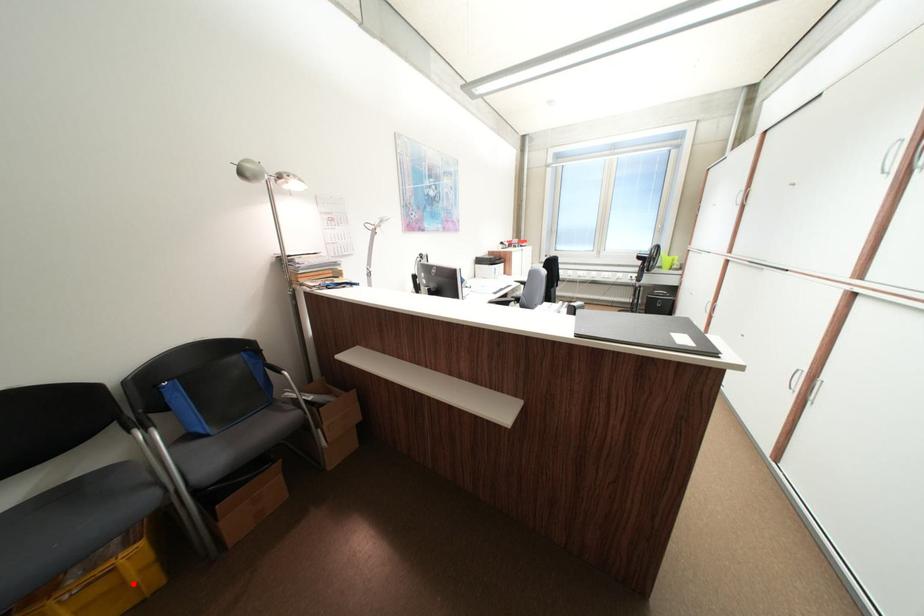
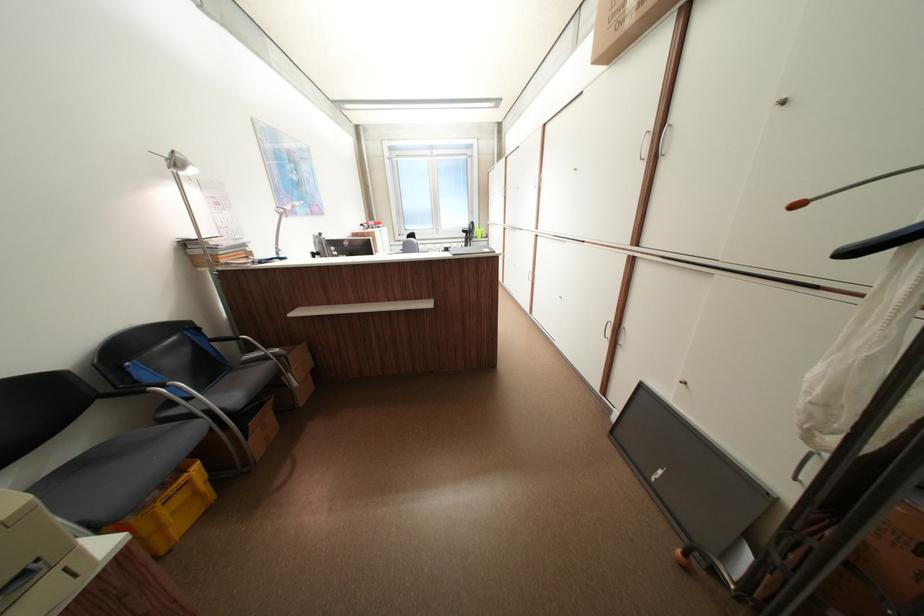
Locate, in the second image, the point that corresponds to the highlighted location in the first image.

(204, 493)